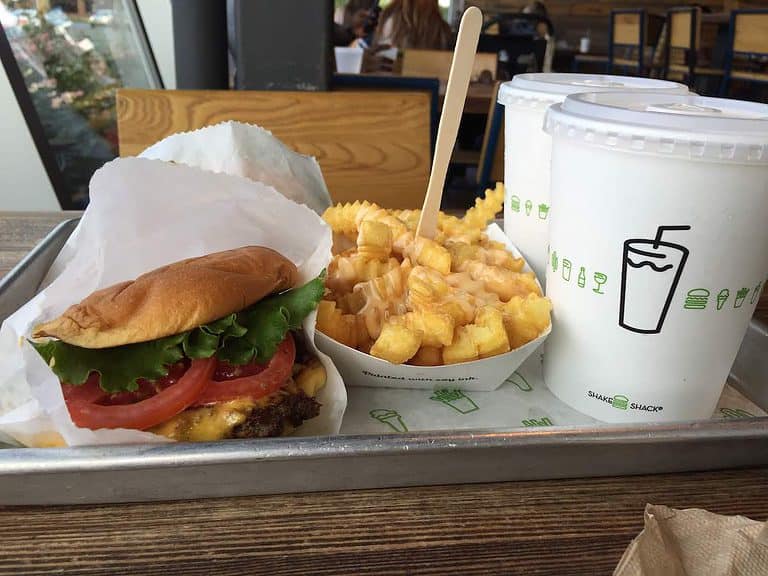
Find the location of a particular element. The height and width of the screenshot is (576, 768). chair is located at coordinates (356, 144).